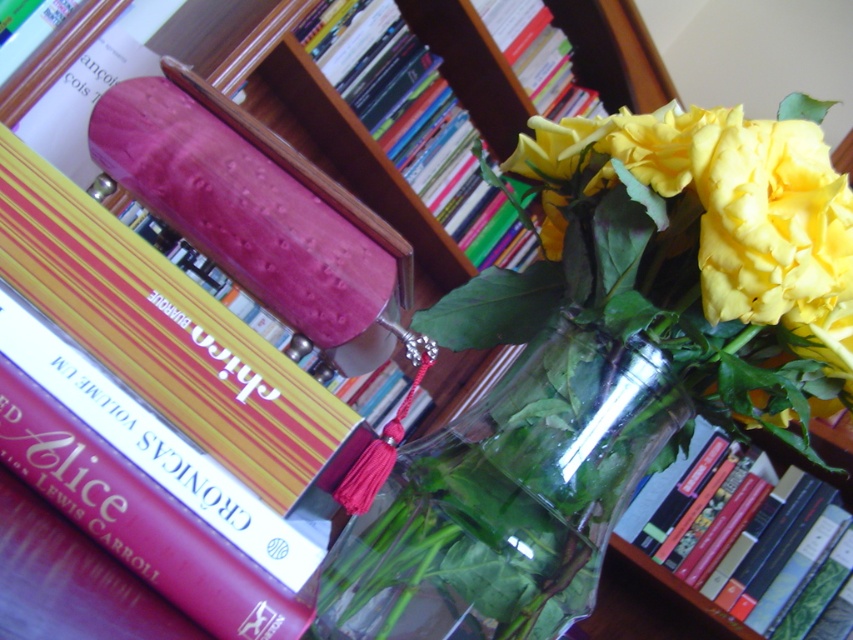
You are standing in the study area and want to take a closer look at the point marked at coordinates (625,413). If your hand can reach up to 45 centimeters, will you be able to touch that point?

The point at coordinates (625,413) is 46.51 centimeters away from the camera. Since your hand can only reach up to 45 centimeters, you will not be able to touch that point.

You are organizing a shelf and need to place both the matte purple book at upper center and the hardcover book at upper center. Which book should you place first to ensure stability?

The matte purple book at upper center is larger in size than the hardcover book at upper center, so you should place the matte purple book at upper center first to ensure stability by using its larger base.

You are standing in the study area and want to place a new book on the shelf. The shelf has two marked spots at coordinates point (370, 116) and point (813, 426). If you want to place the book closer to the glass vase, which coordinate should you choose?

Point (370, 116) is behind point (813, 426), so placing the book at point (370, 116) would be closer to the glass vase.